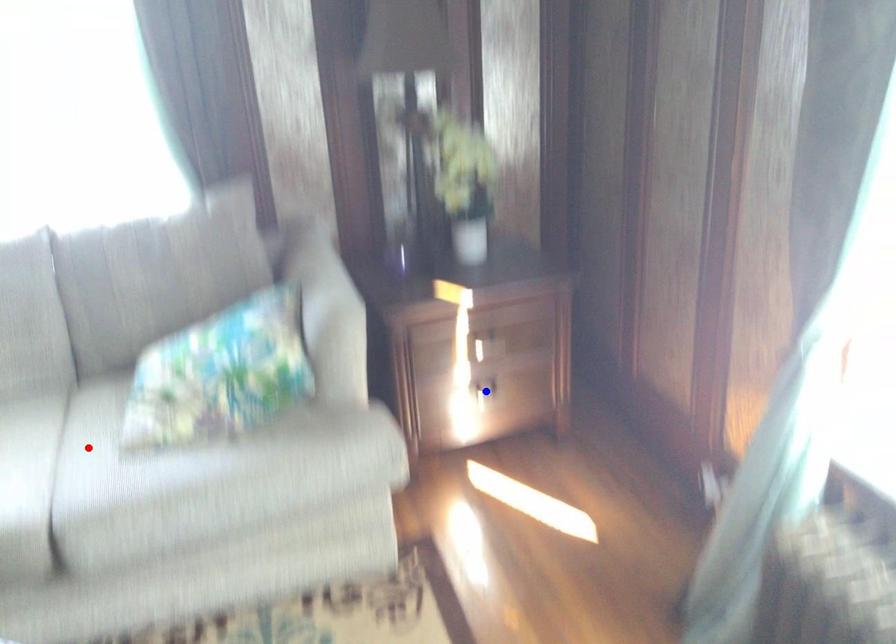
Question: Which of the two points in the image is closer to the camera?

Choices:
 (A) Blue point is closer.
 (B) Red point is closer.

Answer: (B)